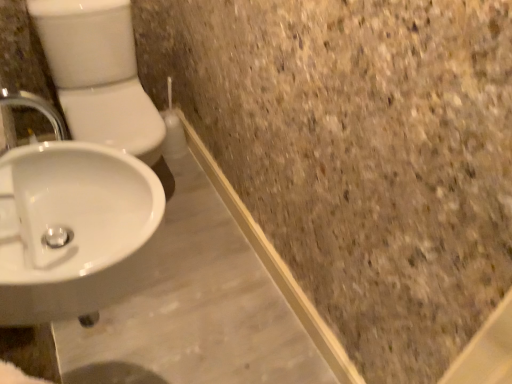
Question: Can you confirm if white glossy sink at lower left is bigger than white glossy toilet bowl at left?

Choices:
 (A) yes
 (B) no

Answer: (B)

Question: Is white glossy sink at lower left at the right side of white glossy toilet bowl at left?

Choices:
 (A) no
 (B) yes

Answer: (B)

Question: From a real-world perspective, is white glossy sink at lower left on top of white glossy toilet bowl at left?

Choices:
 (A) no
 (B) yes

Answer: (B)

Question: Is white glossy sink at lower left next to white glossy toilet bowl at left?

Choices:
 (A) yes
 (B) no

Answer: (B)

Question: Is white glossy sink at lower left positioned with its back to white glossy toilet bowl at left?

Choices:
 (A) no
 (B) yes

Answer: (A)

Question: Considering the relative positions of white glossy sink at lower left and white glossy toilet bowl at left in the image provided, is white glossy sink at lower left to the left of white glossy toilet bowl at left from the viewer's perspective?

Choices:
 (A) yes
 (B) no

Answer: (B)

Question: Can you confirm if white glossy toilet bowl at left is bigger than white glossy sink at lower left?

Choices:
 (A) yes
 (B) no

Answer: (A)

Question: From a real-world perspective, is white glossy toilet bowl at left positioned under white glossy sink at lower left based on gravity?

Choices:
 (A) no
 (B) yes

Answer: (B)

Question: From the image's perspective, does white glossy toilet bowl at left appear higher than white glossy sink at lower left?

Choices:
 (A) yes
 (B) no

Answer: (A)

Question: Does white glossy toilet bowl at left have a lesser width compared to white glossy sink at lower left?

Choices:
 (A) yes
 (B) no

Answer: (B)

Question: Can you confirm if white glossy toilet bowl at left is shorter than white glossy sink at lower left?

Choices:
 (A) yes
 (B) no

Answer: (B)

Question: Is white glossy toilet bowl at left facing towards white glossy sink at lower left?

Choices:
 (A) yes
 (B) no

Answer: (A)

Question: Is white glossy sink at lower left wider or thinner than white glossy toilet bowl at left?

Choices:
 (A) thin
 (B) wide

Answer: (A)